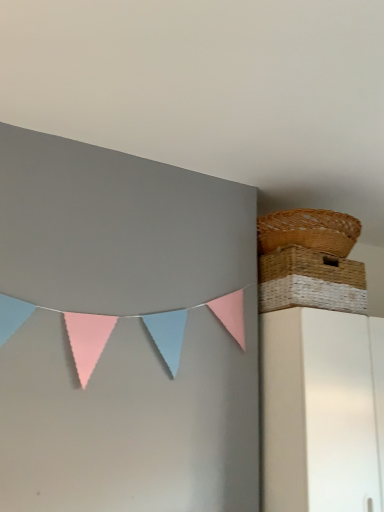
Question: Looking at their shapes, would you say woven straw picnic basket at upper right, placed as the 2th picnic basket when sorted from top to bottom, is wider or thinner than woven brown picnic basket at upper right, acting as the first picnic basket starting from the top?

Choices:
 (A) thin
 (B) wide

Answer: (A)

Question: Choose the correct answer: Is woven straw picnic basket at upper right, placed as the 2th picnic basket when sorted from top to bottom, inside woven brown picnic basket at upper right, acting as the first picnic basket starting from the top, or outside it?

Choices:
 (A) inside
 (B) outside

Answer: (B)

Question: Is woven straw picnic basket at upper right, the first picnic basket positioned from the bottom, to the left or to the right of woven brown picnic basket at upper right, acting as the first picnic basket starting from the top, in the image?

Choices:
 (A) right
 (B) left

Answer: (B)

Question: From their relative heights in the image, would you say woven brown picnic basket at upper right, acting as the first picnic basket starting from the top, is taller or shorter than woven straw picnic basket at upper right, the first picnic basket positioned from the bottom?

Choices:
 (A) short
 (B) tall

Answer: (A)

Question: Would you say woven brown picnic basket at upper right, arranged as the 2th picnic basket when ordered from the bottom, is to the left or to the right of woven straw picnic basket at upper right, the first picnic basket positioned from the bottom, in the picture?

Choices:
 (A) right
 (B) left

Answer: (A)

Question: Looking at the image, does woven brown picnic basket at upper right, arranged as the 2th picnic basket when ordered from the bottom, seem bigger or smaller compared to woven straw picnic basket at upper right, the first picnic basket positioned from the bottom?

Choices:
 (A) small
 (B) big

Answer: (A)

Question: Is woven brown picnic basket at upper right, acting as the first picnic basket starting from the top, inside the boundaries of woven straw picnic basket at upper right, the first picnic basket positioned from the bottom, or outside?

Choices:
 (A) inside
 (B) outside

Answer: (B)